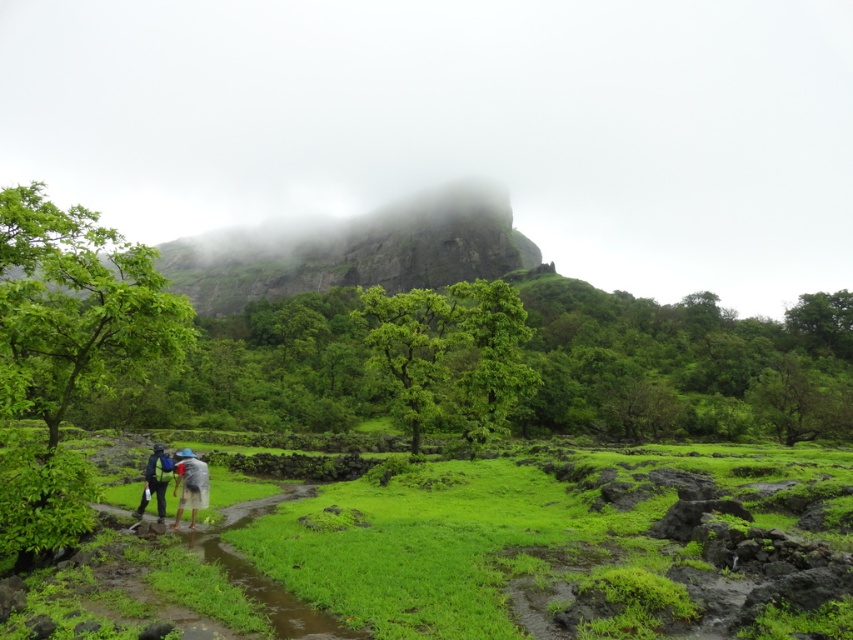
Question: Is raincoat fabric couple at lower center wider than gray fabric umbrella at lower center?

Choices:
 (A) yes
 (B) no

Answer: (A)

Question: Which is farther from the raincoat fabric couple at lower center?

Choices:
 (A) rocky cliff at upper center
 (B) gray fabric umbrella at lower center

Answer: (A)

Question: Which object is closer to the camera taking this photo?

Choices:
 (A) raincoat fabric couple at lower center
 (B) gray fabric umbrella at lower center

Answer: (B)

Question: Is raincoat fabric couple at lower center positioned behind gray fabric umbrella at lower center?

Choices:
 (A) no
 (B) yes

Answer: (B)

Question: Is rocky cliff at upper center bigger than raincoat fabric couple at lower center?

Choices:
 (A) no
 (B) yes

Answer: (B)

Question: Which object appears closest to the camera in this image?

Choices:
 (A) raincoat fabric couple at lower center
 (B) rocky cliff at upper center
 (C) gray fabric umbrella at lower center

Answer: (B)